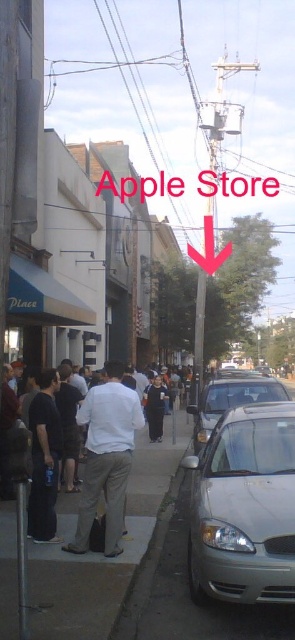
You are a delivery person trying to park your van in the parking spot near the Apple Store. You see the gray concrete sidewalk at lower center and the silver metallic sedan at center. Which object is closer to the Apple Store entrance?

The gray concrete sidewalk at lower center is closer to the Apple Store entrance because it is in front of the silver metallic sedan at center, which is parked behind it.

You are standing at point A, which is at coordinates (x=102, y=554). What object is located at this point in the scene?

The gray concrete sidewalk at lower center is located at point A with coordinates (x=102, y=554).

You are a delivery person who needs to park your 2.5 meter wide van in this street scene. You see the silver metallic car at lower right and the dark blue jeans at center. Which parking spot between these two objects would be suitable for your van?

The silver metallic car at lower right has a larger width than the dark blue jeans at center, so the parking spot near the silver metallic car at lower right would be suitable for your 2.5 meter wide van since it can accommodate a wider vehicle.